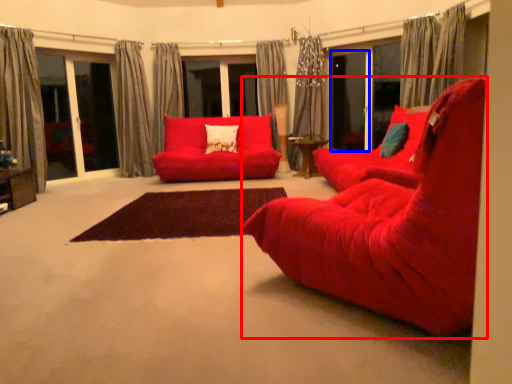
Question: Among these objects, which one is farthest to the camera, chair (highlighted by a red box) or screen door (highlighted by a blue box)?

Choices:
 (A) chair
 (B) screen door

Answer: (B)